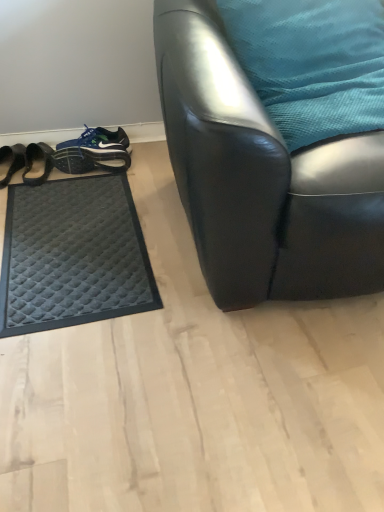
This screenshot has height=512, width=384. Describe the element at coordinates (25, 159) in the screenshot. I see `black quilted mat at left, the second footwear from the right` at that location.

What do you see at coordinates (73, 255) in the screenshot?
I see `black quilted mat at lower left` at bounding box center [73, 255].

At what (x,y) coordinates should I click in order to perform the action: click on black quilted mat at left, the second footwear from the right. Please return your answer as a coordinate pair (x, y). The width and height of the screenshot is (384, 512). Looking at the image, I should click on (25, 159).

Which of these two, black quilted mat at lower left or black quilted mat at left, the second footwear from the right, is bigger?

With larger size is black quilted mat at lower left.

Which is less distant, (143, 305) or (29, 180)?

Point (143, 305).

At what (x,y) coordinates should I click in order to perform the action: click on mat that appears below the black quilted mat at left, the second footwear from the right (from the image's perspective). Please return your answer as a coordinate pair (x, y). Looking at the image, I should click on 73,255.

From their relative heights in the image, would you say black quilted mat at left, the second footwear from the right, is taller or shorter than black leather chair at center?

black quilted mat at left, the second footwear from the right, is shorter than black leather chair at center.

Does point (38, 179) lie in front of point (234, 103)?

No, it is behind (234, 103).

Does black quilted mat at left, the second footwear from the right, have a smaller size compared to black leather chair at center?

Yes, black quilted mat at left, the second footwear from the right, is smaller than black leather chair at center.

Is teal fabric pillow at upper right oriented towards black leather chair at center?

Yes, teal fabric pillow at upper right is aimed at black leather chair at center.

In the scene shown: Does teal fabric pillow at upper right lie behind black leather chair at center?

Yes, it is.

Who is bigger, teal fabric pillow at upper right or black leather chair at center?

black leather chair at center is bigger.

How different are the orientations of teal fabric pillow at upper right and black leather chair at center in degrees?

There is a 4.9-degree angle between the facing directions of teal fabric pillow at upper right and black leather chair at center.

Between black quilted mat at left, which is the 1th footwear from left to right, and black quilted mat at lower left, which one has larger size?

Bigger between the two is black quilted mat at lower left.

Between black quilted mat at left, which is the 1th footwear from left to right, and black quilted mat at lower left, which one has less height?

Standing shorter between the two is black quilted mat at lower left.

In order to click on the 2nd footwear to the left of the black quilted mat at lower left, starting your count from the anchor in this screenshot , I will do `click(25, 159)`.

What's the angular difference between blue fabric shoe at lower left, which appears as the first footwear when viewed from the right, and black quilted mat at left, the second footwear from the right,'s facing directions?

blue fabric shoe at lower left, which appears as the first footwear when viewed from the right, and black quilted mat at left, the second footwear from the right, are facing 77.6 degrees away from each other.

Who is bigger, blue fabric shoe at lower left, the second footwear in the left-to-right sequence, or black quilted mat at left, the second footwear from the right?

With larger size is black quilted mat at left, the second footwear from the right.

Is blue fabric shoe at lower left, which appears as the first footwear when viewed from the right, not close to black quilted mat at left, which is the 1th footwear from left to right?

blue fabric shoe at lower left, which appears as the first footwear when viewed from the right, is near black quilted mat at left, which is the 1th footwear from left to right, not far away.

Is blue fabric shoe at lower left, which appears as the first footwear when viewed from the right, turned away from black quilted mat at left, which is the 1th footwear from left to right?

No, blue fabric shoe at lower left, which appears as the first footwear when viewed from the right, is not facing away from black quilted mat at left, which is the 1th footwear from left to right.

Is black quilted mat at left, the second footwear from the right, situated inside teal fabric pillow at upper right or outside?

The correct answer is: outside.

Considering the sizes of objects black quilted mat at left, which is the 1th footwear from left to right, and teal fabric pillow at upper right in the image provided, who is shorter, black quilted mat at left, which is the 1th footwear from left to right, or teal fabric pillow at upper right?

black quilted mat at left, which is the 1th footwear from left to right, is shorter.

Which is more to the left, black quilted mat at left, the second footwear from the right, or teal fabric pillow at upper right?

Positioned to the left is black quilted mat at left, the second footwear from the right.

Considering the sizes of black leather chair at center and black quilted mat at left, the second footwear from the right, in the image, is black leather chair at center wider or thinner than black quilted mat at left, the second footwear from the right,?

In the image, black leather chair at center appears to be wider than black quilted mat at left, the second footwear from the right.

Which is behind, black leather chair at center or black quilted mat at left, which is the 1th footwear from left to right?

black quilted mat at left, which is the 1th footwear from left to right, is behind.

In terms of height, does black leather chair at center look taller or shorter compared to black quilted mat at left, the second footwear from the right?

Considering their sizes, black leather chair at center has more height than black quilted mat at left, the second footwear from the right.

Where is `footwear that is the 2nd object directly below the black leather chair at center (from a real-world perspective)`? The width and height of the screenshot is (384, 512). footwear that is the 2nd object directly below the black leather chair at center (from a real-world perspective) is located at coordinates (25, 159).

From a real-world perspective, which footwear is the 1st one above the black quilted mat at lower left? Please provide its 2D coordinates.

[(25, 159)]

This screenshot has height=512, width=384. I want to click on chair located in front of the black quilted mat at left, the second footwear from the right, so click(262, 178).

When comparing their distances from black quilted mat at left, the second footwear from the right, does blue fabric shoe at lower left, which appears as the first footwear when viewed from the right, or black quilted mat at lower left seem closer?

blue fabric shoe at lower left, which appears as the first footwear when viewed from the right, is closer to black quilted mat at left, the second footwear from the right.

Based on their spatial positions, is teal fabric pillow at upper right or black quilted mat at lower left further from black leather chair at center?

black quilted mat at lower left.

When comparing their distances from black leather chair at center, does blue fabric shoe at lower left, the second footwear in the left-to-right sequence, or black quilted mat at left, which is the 1th footwear from left to right, seem closer?

The object closer to black leather chair at center is blue fabric shoe at lower left, the second footwear in the left-to-right sequence.

When comparing their distances from blue fabric shoe at lower left, the second footwear in the left-to-right sequence, does black leather chair at center or teal fabric pillow at upper right seem further?

black leather chair at center.

From the image, which object appears to be nearer to black leather chair at center, black quilted mat at lower left or blue fabric shoe at lower left, the second footwear in the left-to-right sequence?

black quilted mat at lower left is positioned closer to the anchor black leather chair at center.

When comparing their distances from teal fabric pillow at upper right, does black leather chair at center or blue fabric shoe at lower left, the second footwear in the left-to-right sequence, seem further?

blue fabric shoe at lower left, the second footwear in the left-to-right sequence.

When comparing their distances from black quilted mat at left, which is the 1th footwear from left to right, does blue fabric shoe at lower left, the second footwear in the left-to-right sequence, or teal fabric pillow at upper right seem closer?

blue fabric shoe at lower left, the second footwear in the left-to-right sequence.

Considering their positions, is black quilted mat at lower left positioned further to black leather chair at center than teal fabric pillow at upper right?

black quilted mat at lower left.

Where is `mat between black quilted mat at left, the second footwear from the right, and teal fabric pillow at upper right`? The height and width of the screenshot is (512, 384). mat between black quilted mat at left, the second footwear from the right, and teal fabric pillow at upper right is located at coordinates (73, 255).

Locate an element on the screen. Image resolution: width=384 pixels, height=512 pixels. mat between teal fabric pillow at upper right and blue fabric shoe at lower left, the second footwear in the left-to-right sequence, in the front-back direction is located at coordinates (73, 255).

In order to click on footwear between black quilted mat at left, the second footwear from the right, and teal fabric pillow at upper right, in the horizontal direction in this screenshot , I will do `click(99, 140)`.

Where is `pillow between black quilted mat at lower left and black leather chair at center from left to right`? The height and width of the screenshot is (512, 384). pillow between black quilted mat at lower left and black leather chair at center from left to right is located at coordinates (312, 63).